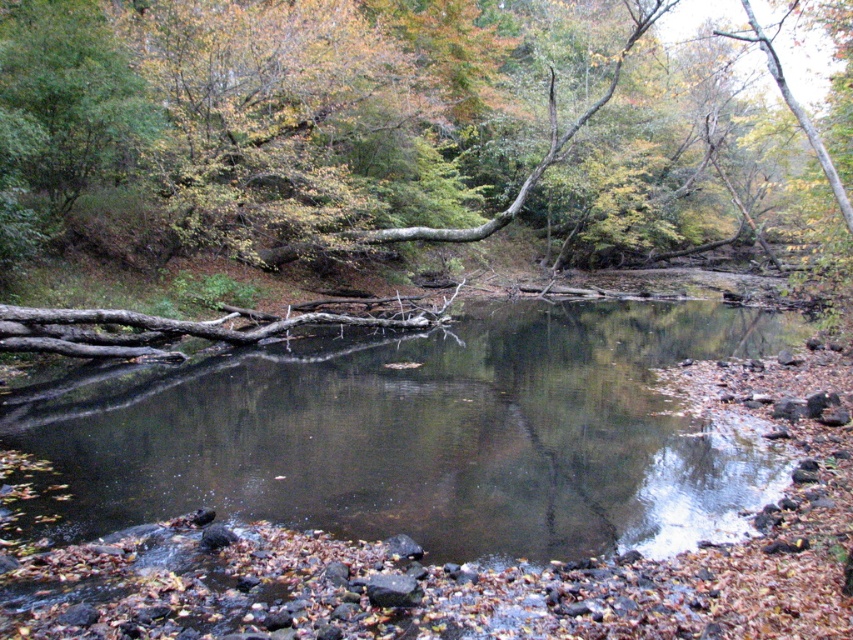
Can you confirm if smooth brown log at center is wider than smooth dark water at center?

Yes, smooth brown log at center is wider than smooth dark water at center.

Who is higher up, smooth brown log at center or smooth dark water at center?

Positioned higher is smooth brown log at center.

Locate an element on the screen. smooth brown log at center is located at coordinates (349, 125).